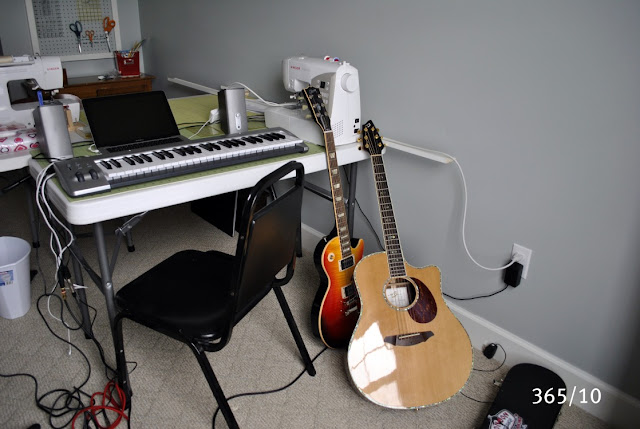
In order to click on keyboard in this screenshot , I will do `click(225, 155)`.